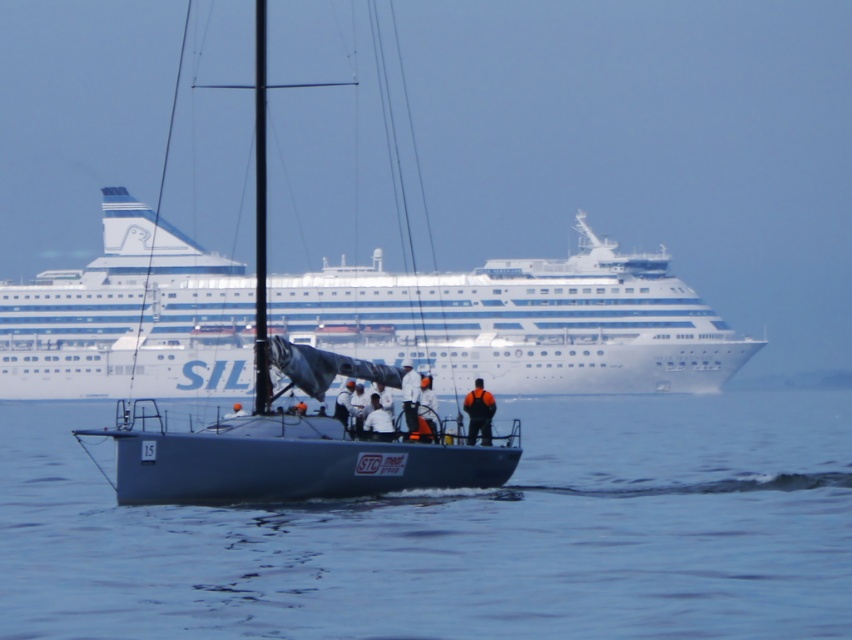
Is blue water at center further to the viewer compared to white fabric shirt at center?

No, it is not.

Who is more forward, (502, 604) or (344, 387)?

Point (502, 604) is more forward.

Locate an element on the screen. This screenshot has width=852, height=640. blue water at center is located at coordinates (461, 534).

Does point (773, 392) lie in front of point (381, 433)?

No, (773, 392) is behind (381, 433).

Does blue water at center lie in front of white fabric at center?

Yes, blue water at center is closer to the viewer.

This screenshot has height=640, width=852. What do you see at coordinates (461, 534) in the screenshot? I see `blue water at center` at bounding box center [461, 534].

You are a GUI agent. You are given a task and a screenshot of the screen. Output one action in this format:
    pyautogui.click(x=<x>, y=<y>)
    Task: Click on the blue water at center
    The width and height of the screenshot is (852, 640).
    Given the screenshot: What is the action you would take?
    pyautogui.click(x=461, y=534)

Between metallic gray sailboat at center and white fabric at center, which one appears on the left side from the viewer's perspective?

metallic gray sailboat at center

Is metallic gray sailboat at center to the right of white fabric at center from the viewer's perspective?

No, metallic gray sailboat at center is not to the right of white fabric at center.

Which is behind, point (227, 452) or point (380, 412)?

Positioned behind is point (380, 412).

I want to click on metallic gray sailboat at center, so click(286, 419).